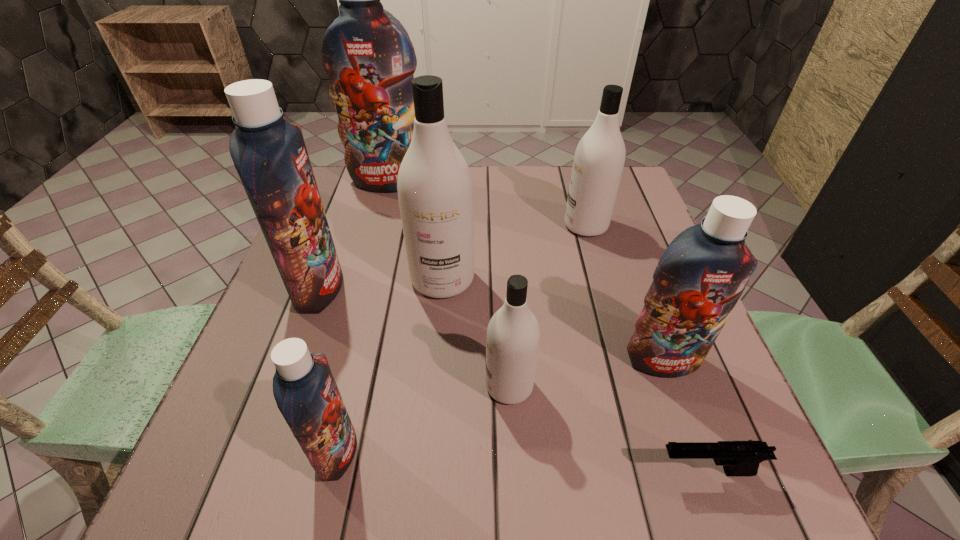
The height and width of the screenshot is (540, 960). In order to click on the farthest object in this screenshot , I will do `click(366, 52)`.

Identify the location of the tallest shampoo. Image resolution: width=960 pixels, height=540 pixels. (366, 52).

Where is `the third nearest blue shampoo`? the third nearest blue shampoo is located at coordinates (269, 154).

At what (x,y) coordinates should I click in order to perform the action: click on the leftmost white shampoo. Please return your answer as a coordinate pair (x, y). Image resolution: width=960 pixels, height=540 pixels. Looking at the image, I should click on (435, 190).

The width and height of the screenshot is (960, 540). Find the location of `the biggest white shampoo`. the biggest white shampoo is located at coordinates (435, 190).

Where is `the second biggest white shampoo`? This screenshot has height=540, width=960. the second biggest white shampoo is located at coordinates (599, 158).

I want to click on the farthest white shampoo, so click(599, 158).

At what (x,y) coordinates should I click in order to perform the action: click on the third biggest blue shampoo. Please return your answer as a coordinate pair (x, y). Looking at the image, I should click on (700, 277).

Locate an element on the screen. the rightmost blue shampoo is located at coordinates (700, 277).

Locate an element on the screen. the smallest blue shampoo is located at coordinates (304, 388).